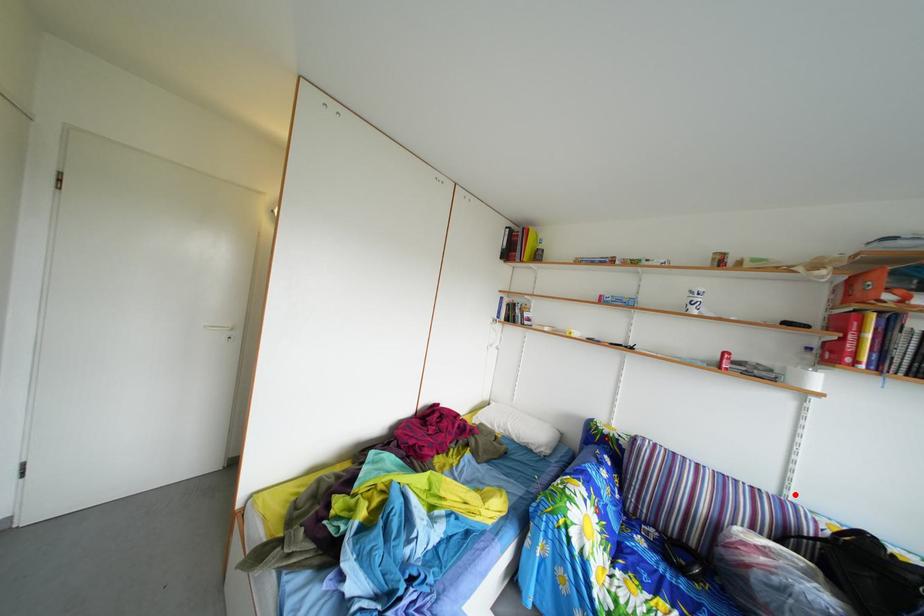
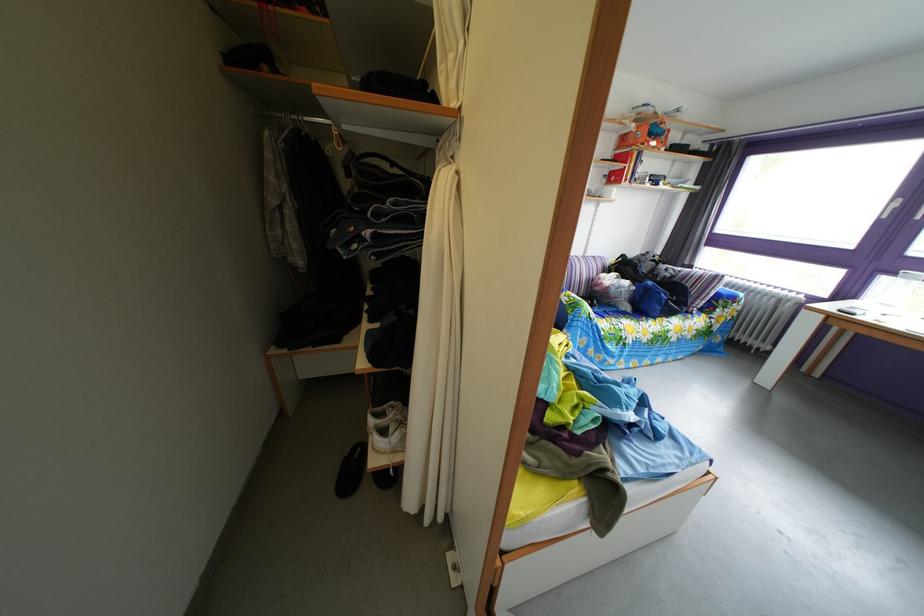
In the second image, find the point that corresponds to the highlighted location in the first image.

(596, 261)